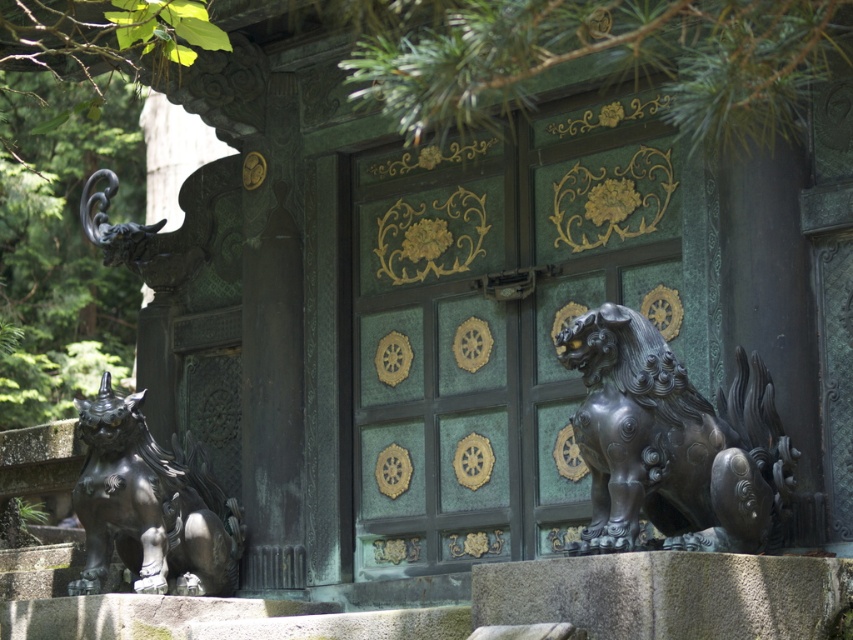
You are a visitor approaching the green patinated metal door at center and the black polished stone lion at right. Which object is closer to you as you approach the entrance?

The black polished stone lion at right is closer to you because the green patinated metal door at center is positioned over it, indicating it is further back.

You are a visitor approaching the door and want to touch both the black polished stone lion at right and the bronze statue at lower left. Which one should you approach first if you are standing in front of the door facing it?

The bronze statue at lower left is on the left side of the door, so you should approach it first as it is on your left when facing the door.

You are an art conservator assessing the structural integrity of the black polished stone lion at right and the bronze statue at lower left. Based on their dimensions, which lion might require additional support due to its shape?

The black polished stone lion at right is thinner than the bronze statue at lower left, so it might require additional support due to its narrower structure.